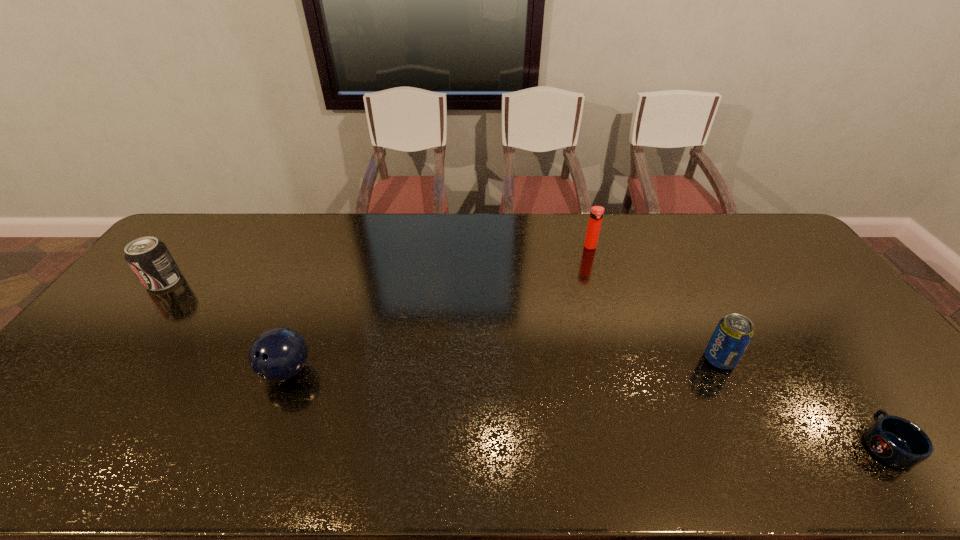
Identify the location of vacant space situated on the right of the fourth nearest object. Image resolution: width=960 pixels, height=540 pixels. (230, 281).

Locate an element on the screen. Image resolution: width=960 pixels, height=540 pixels. blank space located on the left of the fourth object from left to right is located at coordinates (640, 359).

In order to click on vacant area situated on the surface of the bowling ball near the finger holes in this screenshot , I will do `click(267, 423)`.

Find the location of a particular element. This screenshot has height=540, width=960. vacant space positioned 0.330m with the handle on the side of the rightmost object is located at coordinates (795, 318).

Locate an element on the screen. blank space located with the handle on the side of the rightmost object is located at coordinates (810, 339).

This screenshot has height=540, width=960. What are the coordinates of `vacant area situated with the handle on the side of the rightmost object` in the screenshot? It's located at (838, 378).

Where is `object situated at the far edge`? object situated at the far edge is located at coordinates (596, 214).

Locate an element on the screen. object present at the near edge is located at coordinates (898, 442).

You are a GUI agent. You are given a task and a screenshot of the screen. Output one action in this format:
    pyautogui.click(x=<x>, y=<y>)
    Task: Click on the object that is at the left edge
    The image size is (960, 540).
    Given the screenshot: What is the action you would take?
    pyautogui.click(x=149, y=258)

Find the location of `object situated at the right edge`. object situated at the right edge is located at coordinates (898, 442).